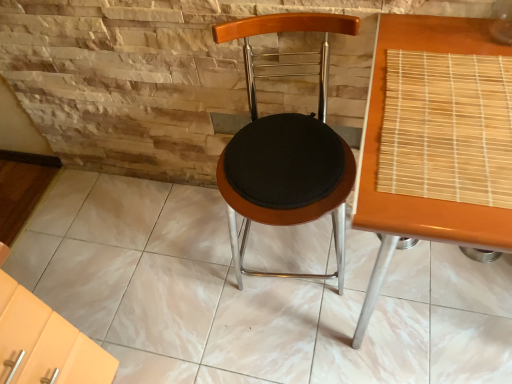
Identify the location of vacant region to the left of woodenseat cushion at center. This screenshot has width=512, height=384. (185, 277).